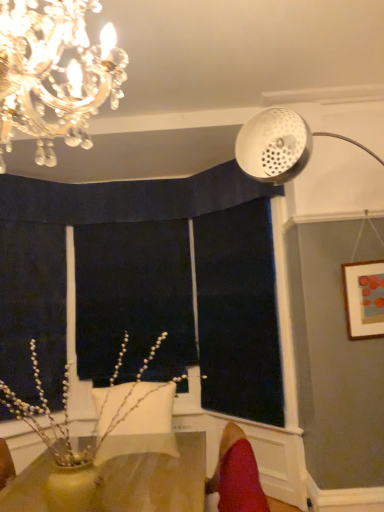
Question: Does black fabric at center, the second window screen in the right-to-left sequence, have a larger size compared to dark blue fabric at center, which ranks as the first window screen in right-to-left order?

Choices:
 (A) yes
 (B) no

Answer: (A)

Question: Is black fabric at center, marked as the first window screen in a left-to-right arrangement, thinner than dark blue fabric at center, which ranks as the first window screen in right-to-left order?

Choices:
 (A) yes
 (B) no

Answer: (B)

Question: Is black fabric at center, marked as the first window screen in a left-to-right arrangement, aimed at dark blue fabric at center, which is counted as the 2th window screen, starting from the left?

Choices:
 (A) yes
 (B) no

Answer: (B)

Question: Can we say black fabric at center, marked as the first window screen in a left-to-right arrangement, lies outside dark blue fabric at center, which ranks as the first window screen in right-to-left order?

Choices:
 (A) yes
 (B) no

Answer: (A)

Question: Does black fabric at center, the second window screen in the right-to-left sequence, have a greater height compared to dark blue fabric at center, which is counted as the 2th window screen, starting from the left?

Choices:
 (A) no
 (B) yes

Answer: (A)

Question: In terms of width, does black fabric at center, the second window screen in the right-to-left sequence, look wider or thinner when compared to red velvet swivel chair at lower right?

Choices:
 (A) wide
 (B) thin

Answer: (B)

Question: Considering their positions, is black fabric at center, the second window screen in the right-to-left sequence, located in front of or behind red velvet swivel chair at lower right?

Choices:
 (A) front
 (B) behind

Answer: (B)

Question: Considering the positions of black fabric at center, marked as the first window screen in a left-to-right arrangement, and red velvet swivel chair at lower right in the image, is black fabric at center, marked as the first window screen in a left-to-right arrangement, taller or shorter than red velvet swivel chair at lower right?

Choices:
 (A) tall
 (B) short

Answer: (A)

Question: In the image, is black fabric at center, the second window screen in the right-to-left sequence, on the left side or the right side of red velvet swivel chair at lower right?

Choices:
 (A) right
 (B) left

Answer: (B)

Question: In terms of size, does white pearlized branches at lower left appear bigger or smaller than red velvet swivel chair at lower right?

Choices:
 (A) big
 (B) small

Answer: (A)

Question: Looking at their shapes, would you say white pearlized branches at lower left is wider or thinner than red velvet swivel chair at lower right?

Choices:
 (A) thin
 (B) wide

Answer: (B)

Question: Is white pearlized branches at lower left inside the boundaries of red velvet swivel chair at lower right, or outside?

Choices:
 (A) inside
 (B) outside

Answer: (B)

Question: From a real-world perspective, relative to red velvet swivel chair at lower right, is white pearlized branches at lower left vertically above or below?

Choices:
 (A) above
 (B) below

Answer: (A)

Question: Is point (345, 270) positioned closer to the camera than point (89, 453)?

Choices:
 (A) farther
 (B) closer

Answer: (A)

Question: In the image, is matte white picture frame at upper right positioned in front of or behind white pearlized branches at lower left?

Choices:
 (A) behind
 (B) front

Answer: (A)